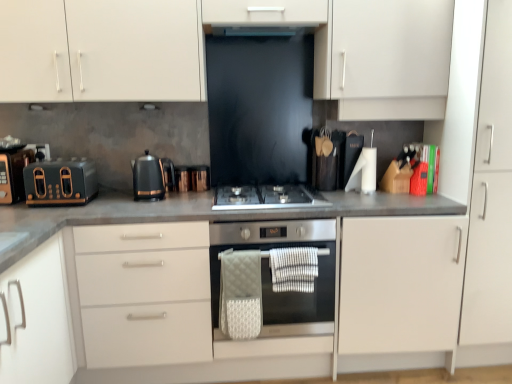
Locate an element on the screen. unoccupied area in front of shiny copper kettle at center, the 2th appliance viewed from the left is located at coordinates (176, 200).